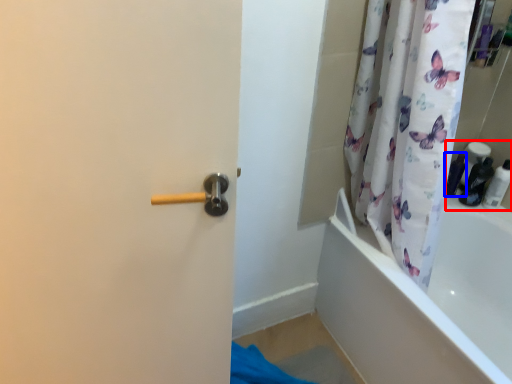
Question: Among these objects, which one is nearest to the camera, toiletry (highlighted by a red box) or toiletry (highlighted by a blue box)?

Choices:
 (A) toiletry
 (B) toiletry

Answer: (A)